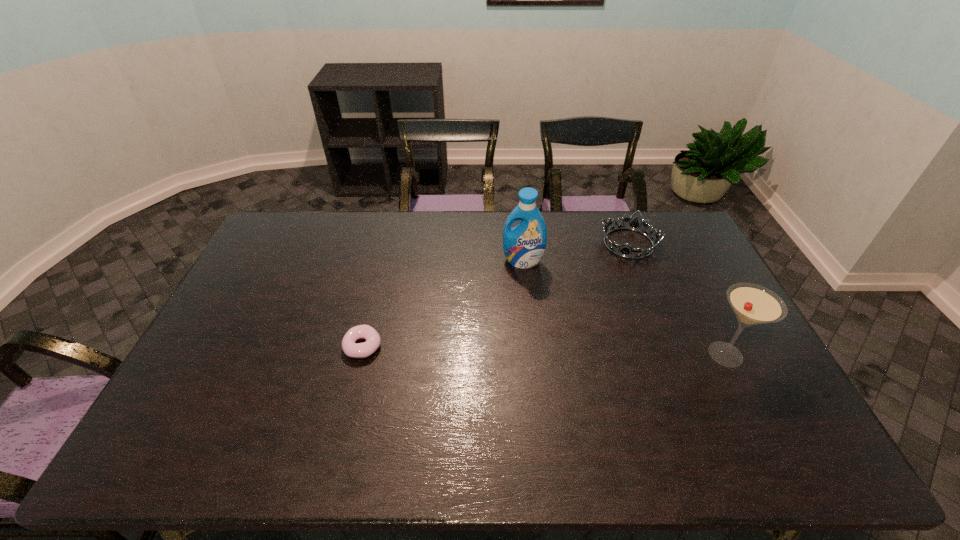
In the image, there is a desktop. Where is `vacant space at the left edge`? The image size is (960, 540). vacant space at the left edge is located at coordinates (241, 307).

This screenshot has height=540, width=960. Find the location of `vacant space at the right edge of the desktop`. vacant space at the right edge of the desktop is located at coordinates (715, 318).

This screenshot has width=960, height=540. I want to click on free region at the far left corner of the desktop, so click(262, 245).

This screenshot has height=540, width=960. Find the location of `vacant area at the near left corner`. vacant area at the near left corner is located at coordinates (186, 401).

I want to click on blank region between the tiara and the second tallest object, so click(x=677, y=299).

The height and width of the screenshot is (540, 960). Identify the location of empty space that is in between the shortest object and the third object from right to left. (443, 303).

Locate an element on the screen. free spot between the third object from right to left and the third shortest object is located at coordinates (624, 308).

The height and width of the screenshot is (540, 960). What are the coordinates of `vacant point located between the second tallest object and the second object from left to right` in the screenshot? It's located at (624, 308).

Identify the location of vacant space that's between the tiara and the detergent. (576, 252).

You are a GUI agent. You are given a task and a screenshot of the screen. Output one action in this format:
    pyautogui.click(x=<x>, y=<y>)
    Task: Click on the vacant point located between the third shortest object and the tiara
    This screenshot has width=960, height=540.
    Given the screenshot: What is the action you would take?
    pyautogui.click(x=677, y=299)